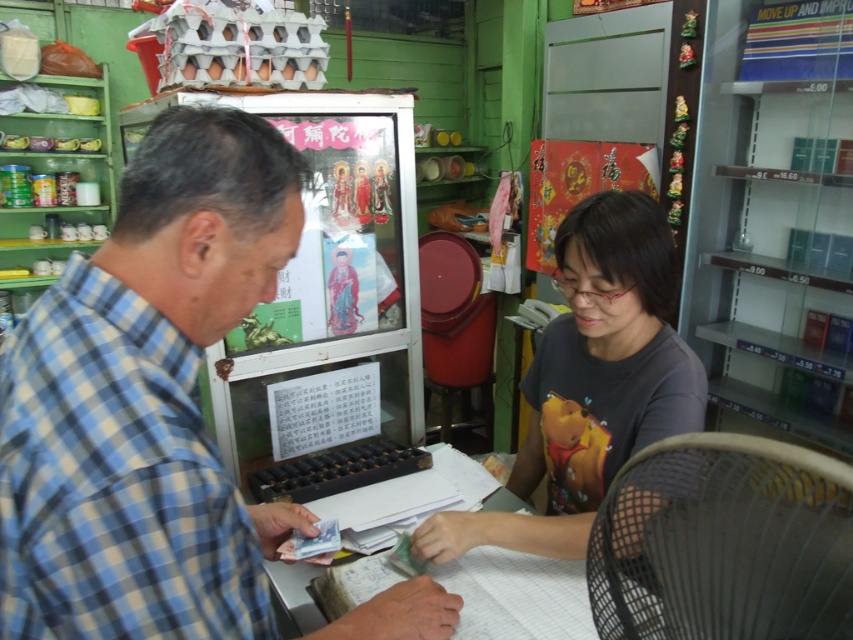
Can you confirm if blue plaid shirt at left is bigger than gray matte shirt at center?

Actually, blue plaid shirt at left might be smaller than gray matte shirt at center.

Who is higher up, blue plaid shirt at left or gray matte shirt at center?

gray matte shirt at center

The image size is (853, 640). I want to click on blue plaid shirt at left, so click(146, 401).

Where is `blue plaid shirt at left`? blue plaid shirt at left is located at coordinates (146, 401).